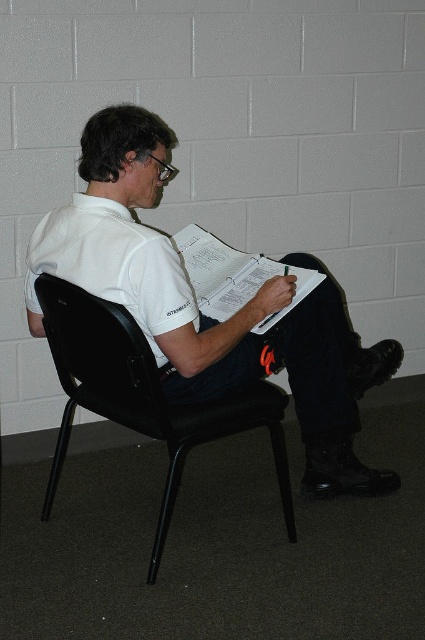
You are an office assistant who needs to hang a name tag on either the white matte shirt at center or the white paper clipboard at center. Which object would allow the name tag to be more visible from above?

The white matte shirt at center has a greater height compared to the white paper clipboard at center, so the name tag would be more visible from above if placed on the white matte shirt at center.

You are an office worker who needs to retrieve the white paper clipboard at center from its current position. The black plastic chair at center is in your way. Can you move the chair to access the clipboard?

The black plastic chair at center is below the white paper clipboard at center, so the chair is positioned under the clipboard. Since the chair is directly beneath the clipboard, moving the chair would allow you to access the clipboard.